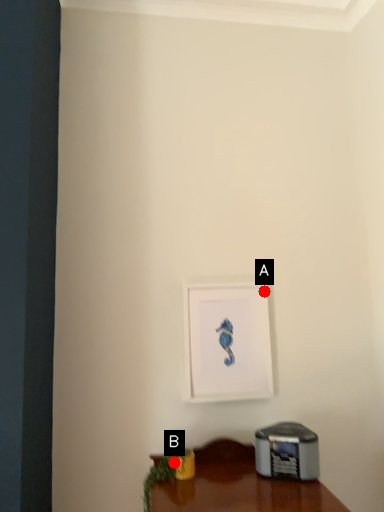
Question: Two points are circled on the image, labeled by A and B beside each circle. Which point is closer to the camera taking this photo?

Choices:
 (A) A is closer
 (B) B is closer

Answer: (B)